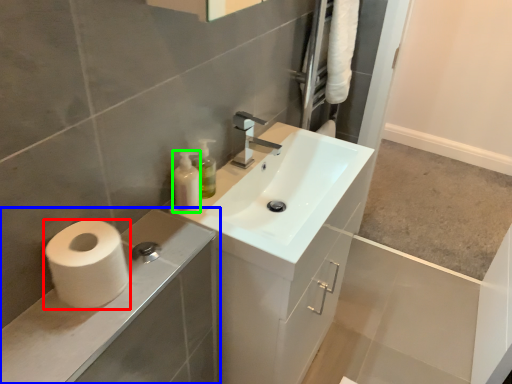
Question: Estimate the real-world distances between objects in this image. Which object is farther from toilet paper (highlighted by a red box), bathroom cabinet (highlighted by a blue box) or toiletry (highlighted by a green box)?

Choices:
 (A) bathroom cabinet
 (B) toiletry

Answer: (B)